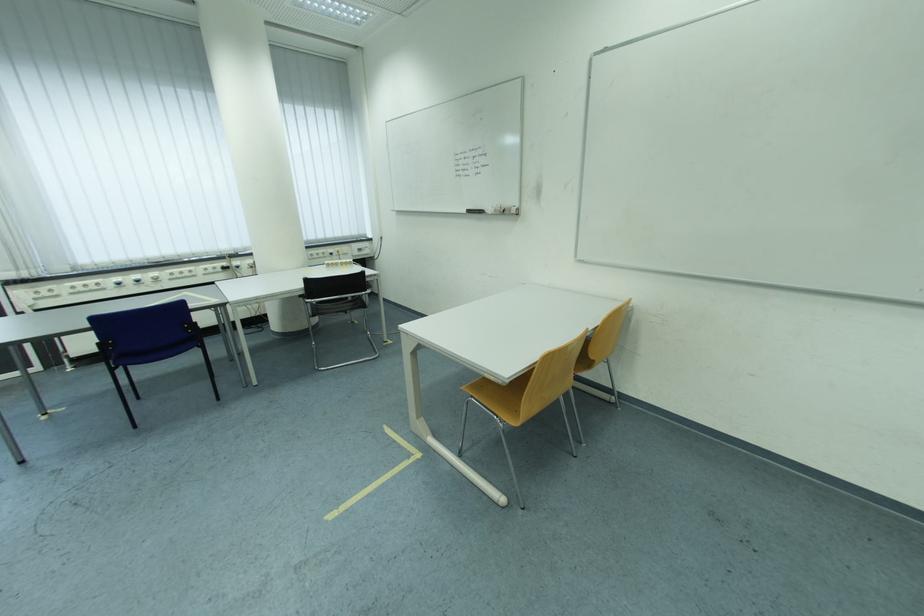
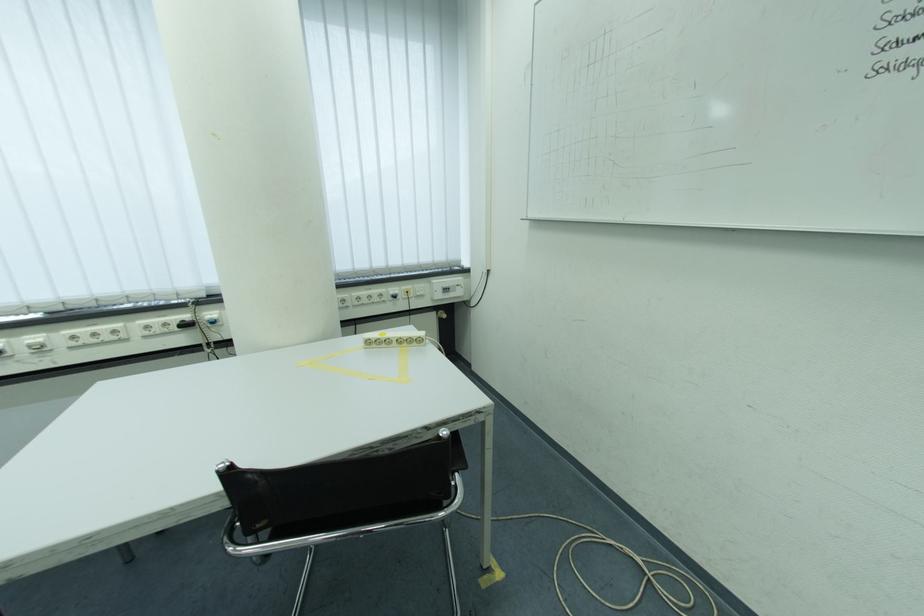
The point at (x=245, y=265) is marked in the first image. Where is the corresponding point in the second image?

(217, 315)